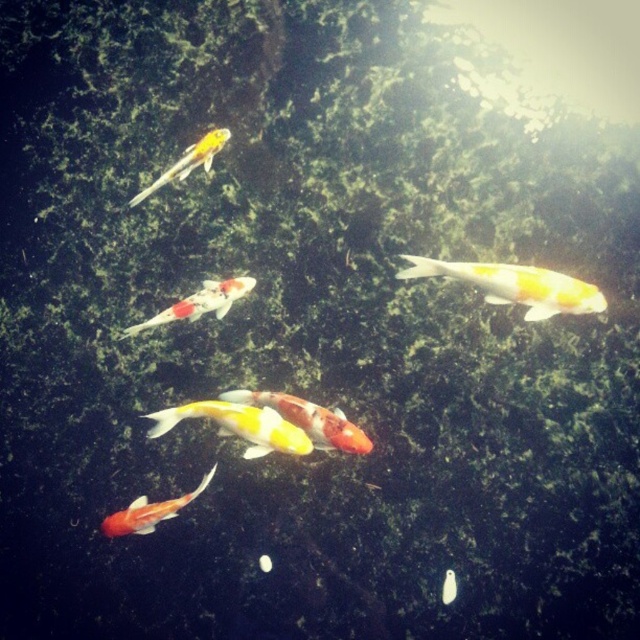
Question: Which object appears farthest from the camera in this image?

Choices:
 (A) shiny multicolored fish at center
 (B) yellow and white koi fish at center
 (C) shiny metallic fish at upper left

Answer: (C)

Question: Among these objects, which one is farthest from the camera?

Choices:
 (A) shiny metallic fish at upper left
 (B) shiny goldfish at upper right
 (C) shiny orange and white fish at bottom left

Answer: (A)

Question: Which object is closer to the camera taking this photo?

Choices:
 (A) shiny multicolored fish at center
 (B) shiny metallic fish at upper left

Answer: (A)

Question: From the image, what is the correct spatial relationship of shiny metallic fish at center in relation to shiny orange and white fish at bottom left?

Choices:
 (A) left
 (B) right

Answer: (B)

Question: Can you confirm if shiny orange and white fish at bottom left is bigger than shiny metallic fish at upper left?

Choices:
 (A) yes
 (B) no

Answer: (B)

Question: Can you confirm if shiny goldfish at upper right is positioned above shiny metallic fish at upper left?

Choices:
 (A) no
 (B) yes

Answer: (A)